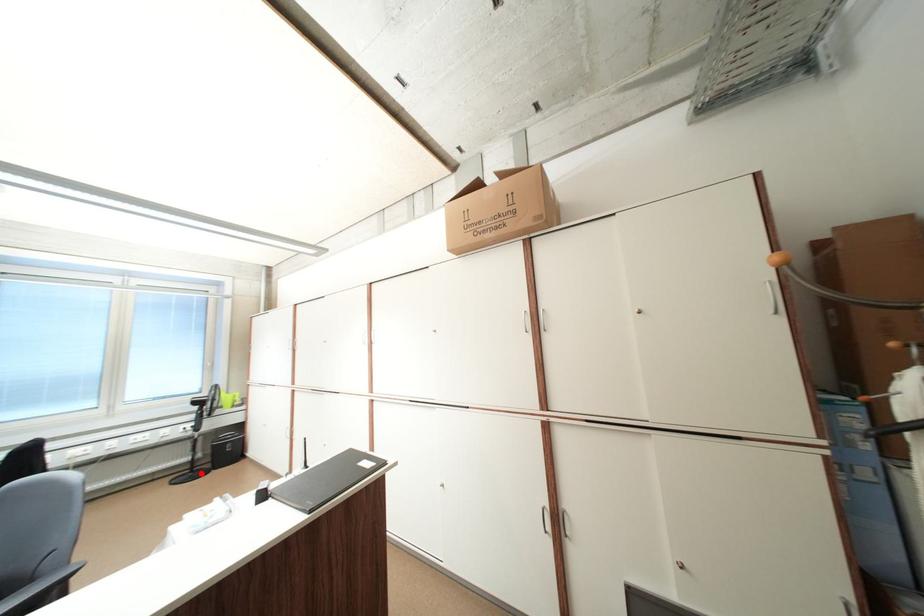
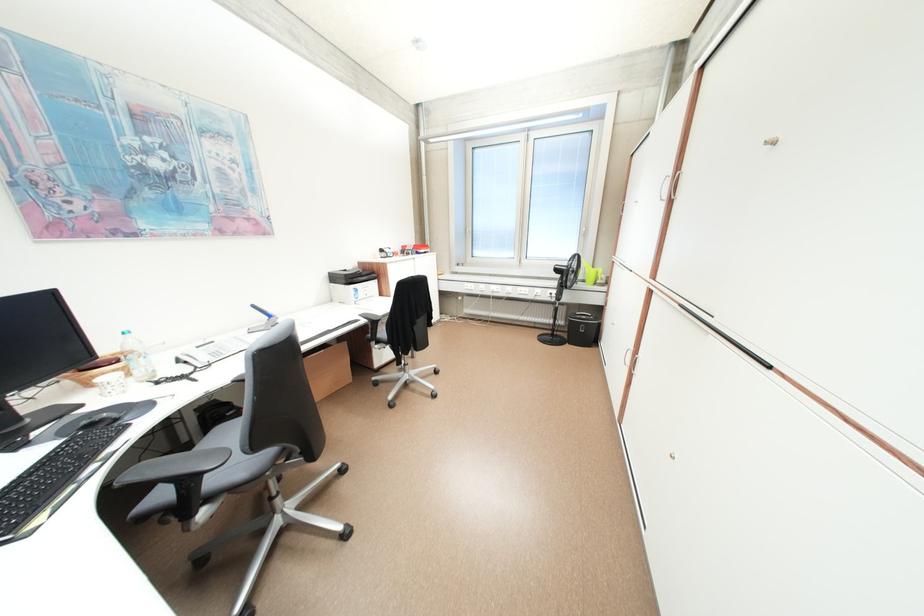
Locate, in the second image, the point that corresponds to the highlighted location in the first image.

(561, 338)